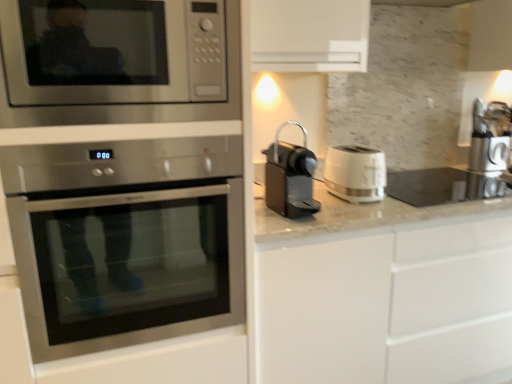
I want to click on vacant region to the left of black plastic coffee machine at center, which ranks as the second coffee machine in back-to-front order, so click(x=261, y=213).